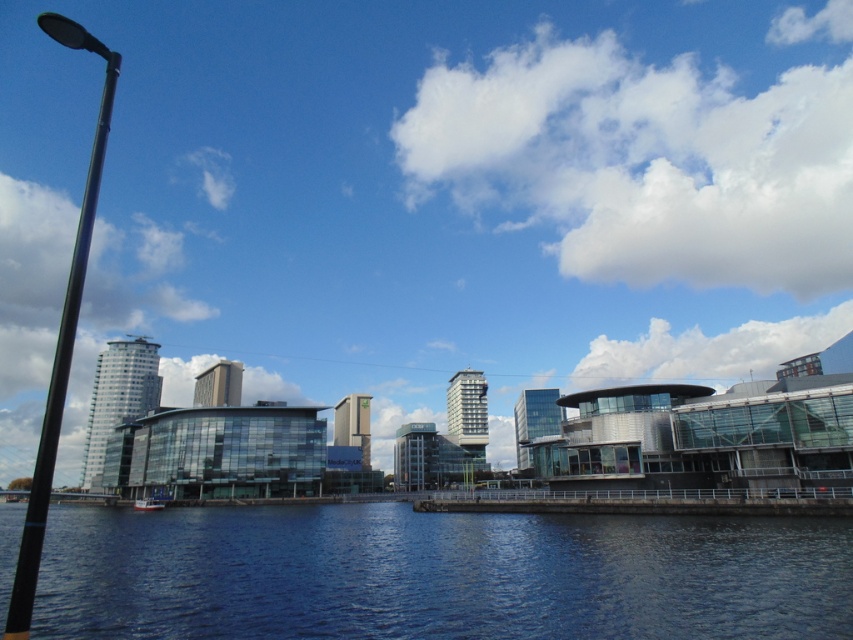
Question: Which point is farther from the camera taking this photo?

Choices:
 (A) (698, 552)
 (B) (148, 502)

Answer: (B)

Question: Does blue glassy water at lower center appear on the left side of black metal pole at left?

Choices:
 (A) no
 (B) yes

Answer: (A)

Question: Which of the following is the farthest from the observer?

Choices:
 (A) (144, 499)
 (B) (310, 621)
 (C) (38, 524)

Answer: (A)

Question: Does blue glassy water at lower center have a smaller size compared to white plastic boat at lower left?

Choices:
 (A) no
 (B) yes

Answer: (A)

Question: Does black metal pole at left appear on the right side of white plastic boat at lower left?

Choices:
 (A) yes
 (B) no

Answer: (B)

Question: Which of the following is the farthest from the observer?

Choices:
 (A) (137, 500)
 (B) (103, 148)
 (C) (744, 525)

Answer: (B)